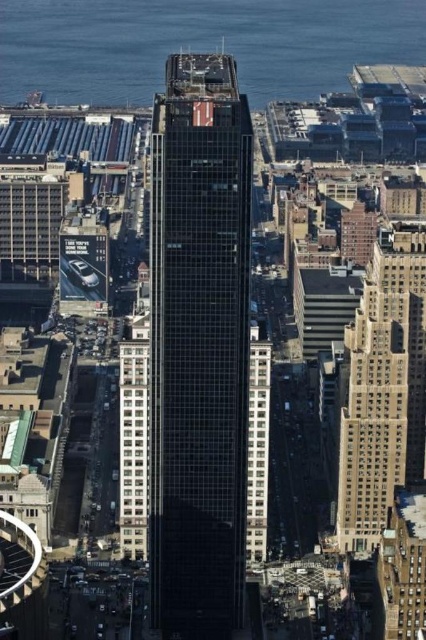
You are a city planner reviewing this urban layout. You need to determine if the black glass skyscraper at center will block sunlight from reaching the beige stone building at right. Based on their relative heights, can you infer anything about their potential shadow casting?

The black glass skyscraper at center is taller than the beige stone building at right, so it is likely to cast a larger shadow that could block sunlight from reaching the beige stone building at right.